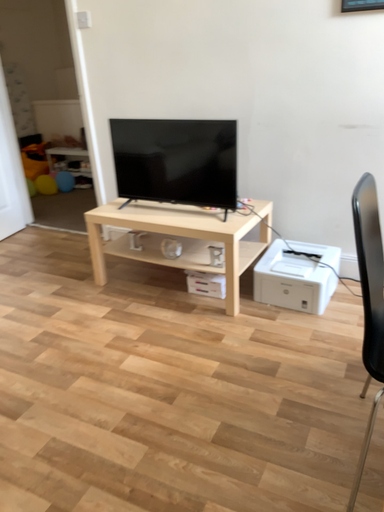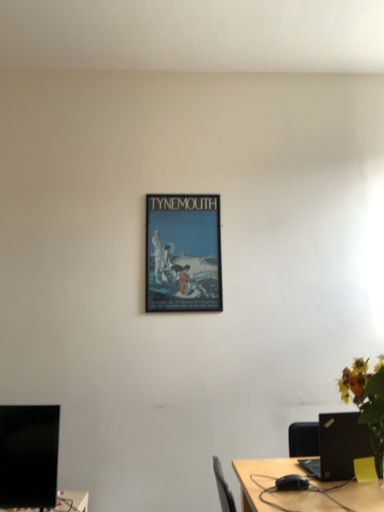
Question: Which way did the camera rotate in the video?

Choices:
 (A) rotated upward
 (B) rotated downward

Answer: (A)